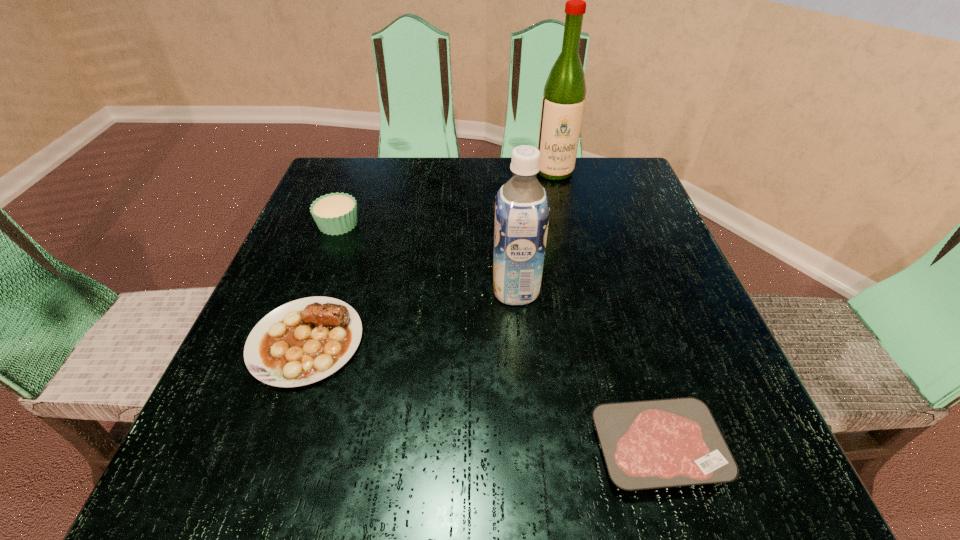
At what (x,y) coordinates should I click in order to perform the action: click on liquor. Please return your answer as a coordinate pair (x, y). Image resolution: width=960 pixels, height=540 pixels. Looking at the image, I should click on (563, 101).

The width and height of the screenshot is (960, 540). Find the location of `the farthest object`. the farthest object is located at coordinates (563, 101).

At what (x,y) coordinates should I click in order to perform the action: click on soya milk. Please return your answer as a coordinate pair (x, y). Looking at the image, I should click on (522, 211).

What are the coordinates of `the third object from right to left` in the screenshot? It's located at (522, 211).

Where is `the fourth nearest object`? The image size is (960, 540). the fourth nearest object is located at coordinates (336, 213).

At what (x,y) coordinates should I click in order to perform the action: click on the third shortest object. Please return your answer as a coordinate pair (x, y). Image resolution: width=960 pixels, height=540 pixels. Looking at the image, I should click on (336, 213).

This screenshot has height=540, width=960. In order to click on the farther steak in this screenshot , I will do `click(304, 341)`.

The image size is (960, 540). Identify the location of the taller steak. 304,341.

The image size is (960, 540). Find the location of `the shortest object`. the shortest object is located at coordinates (649, 444).

You are a GUI agent. You are given a task and a screenshot of the screen. Output one action in this format:
    pyautogui.click(x=<x>, y=<y>)
    Task: Click on the nearer steak
    
    Given the screenshot: What is the action you would take?
    pyautogui.click(x=649, y=444)